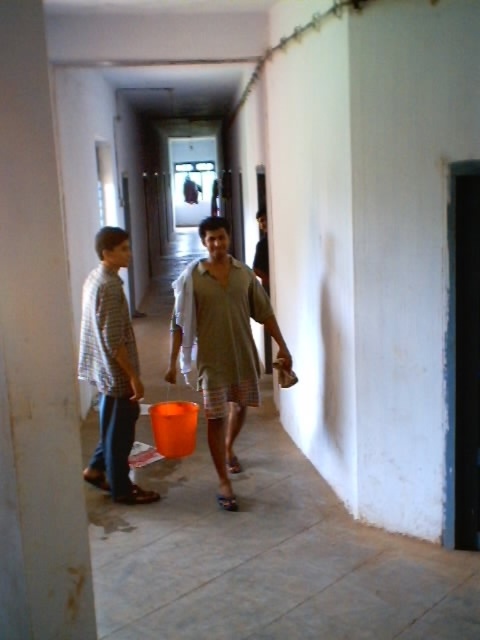
Question: Which object appears closest to the camera in this image?

Choices:
 (A) matte khaki shirt at center
 (B) checkered fabric shirt at left
 (C) white painted pillar at left

Answer: (C)

Question: Estimate the real-world distances between objects in this image. Which object is closer to the matte khaki shirt at center?

Choices:
 (A) white painted pillar at left
 (B) checkered fabric shirt at left

Answer: (B)

Question: Can you confirm if white painted pillar at left is wider than matte khaki shirt at center?

Choices:
 (A) no
 (B) yes

Answer: (A)

Question: Can you confirm if white painted pillar at left is smaller than matte khaki shirt at center?

Choices:
 (A) no
 (B) yes

Answer: (B)

Question: Among these points, which one is farthest from the camera?

Choices:
 (A) (127, 320)
 (B) (32, 204)

Answer: (A)

Question: Is white painted pillar at left smaller than matte khaki shirt at center?

Choices:
 (A) yes
 (B) no

Answer: (A)